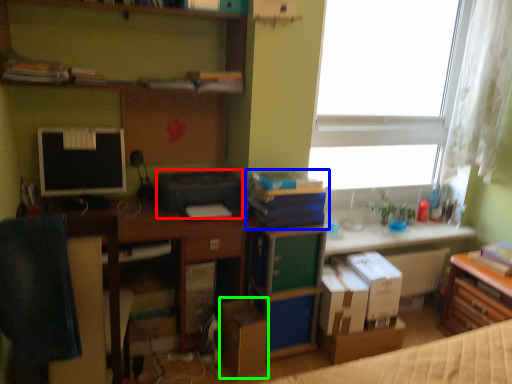
Question: Which is nearer to the printer (highlighted by a red box)? book (highlighted by a blue box) or cardboard box (highlighted by a green box).

Choices:
 (A) book
 (B) cardboard box

Answer: (A)